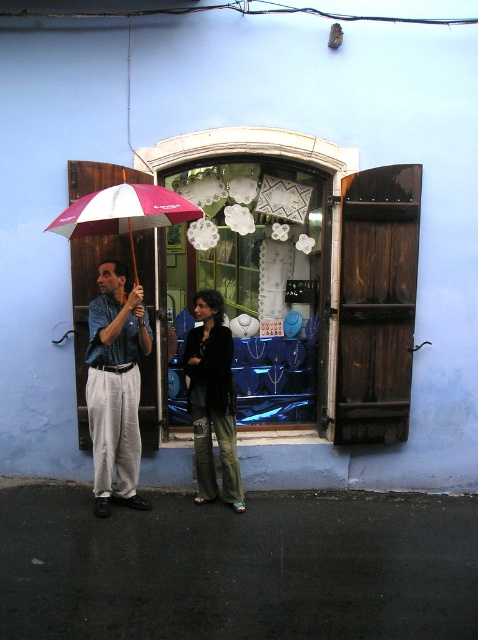
In the scene shown: You are standing at the point (291, 369) and want to enter the shop through the open wooden door. Can you reach the door without crossing the 6 meters distance limit?

The distance between you and the door is 6.06 meters, which exceeds the 6 meters limit, so you cannot reach the door without crossing the distance limit.

In the scene shown: You are a delivery person carrying a box that is 1.5 meters long. You need to walk through the space between the dark brown wooden shutter at right and the matte blue pants at left. Can you fit through this space with your box?

The distance between dark brown wooden shutter at right and matte blue pants at left is 1.42 meters. Since the box is 1.5 meters long, it is slightly longer than the available space. Therefore, the box cannot fit through the space between them.

You are a customer in the shop and want to see both the matte glass jewelry at center and the matte blue pants at left. Which one is closer to the entrance of the shop?

The matte glass jewelry at center is closer to the entrance than the matte blue pants at left because the pants are behind the jewelry.